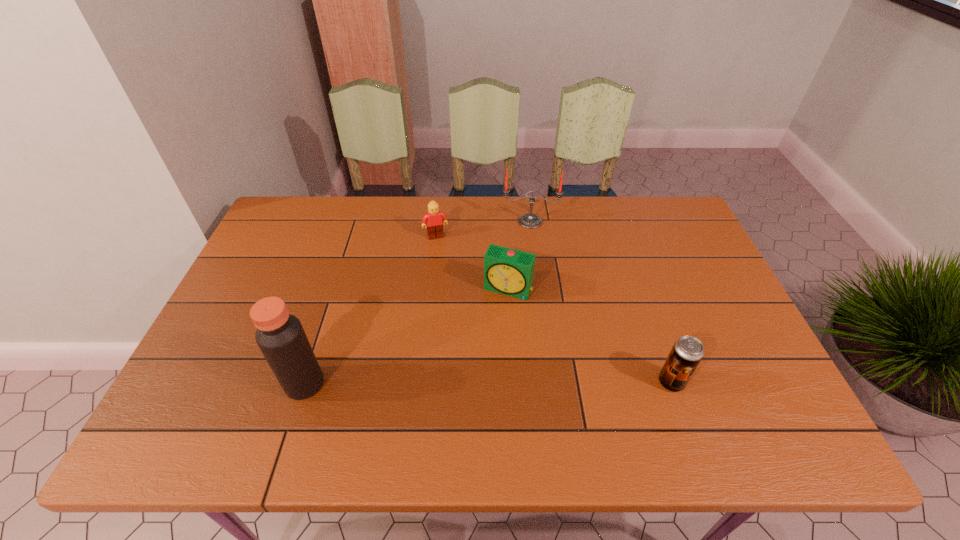
Where is `free space on the desktop that is between the tallest object and the rightmost object and is positioned on the face of the Lego`? free space on the desktop that is between the tallest object and the rightmost object and is positioned on the face of the Lego is located at coordinates (480, 383).

Where is `vacant spot on the desktop that is between the vinegar and the beer can and is positioned on the front-facing side of the third farthest object`? vacant spot on the desktop that is between the vinegar and the beer can and is positioned on the front-facing side of the third farthest object is located at coordinates (468, 383).

Where is `free space on the desktop that is between the tallest object and the rightmost object and is positioned on the front-facing side of the candle`? Image resolution: width=960 pixels, height=540 pixels. free space on the desktop that is between the tallest object and the rightmost object and is positioned on the front-facing side of the candle is located at coordinates (538, 383).